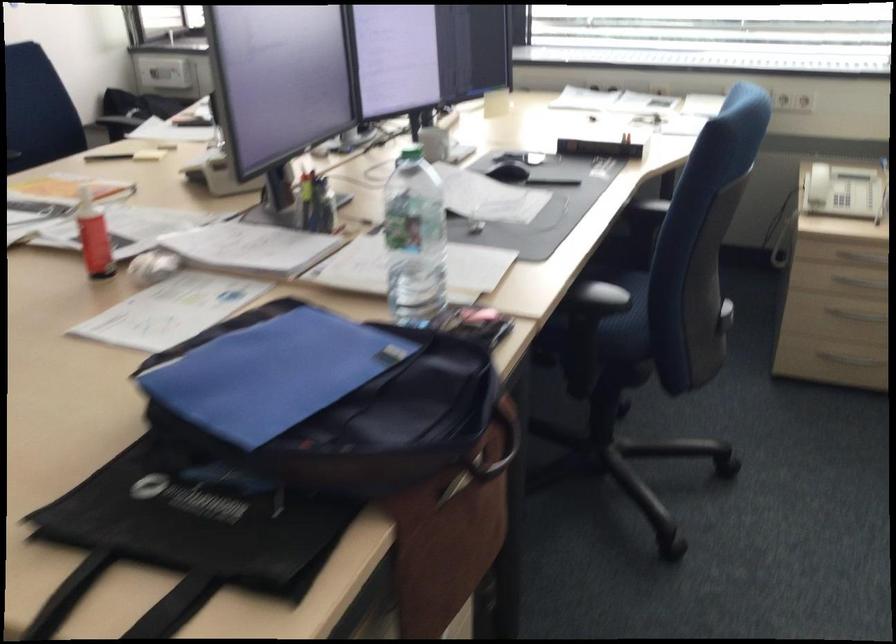
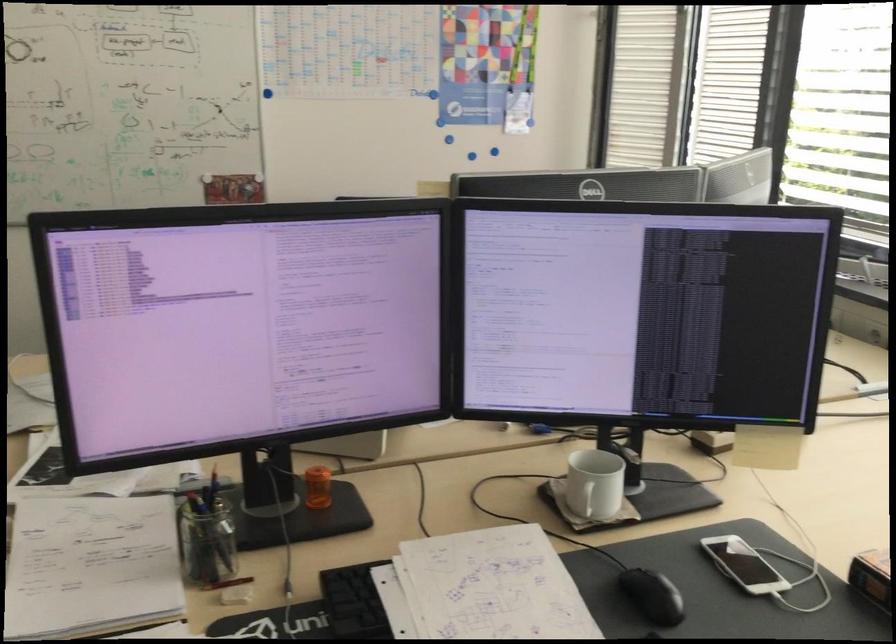
Where in the second image is the point corresponding to (349,227) from the first image?

(234, 596)